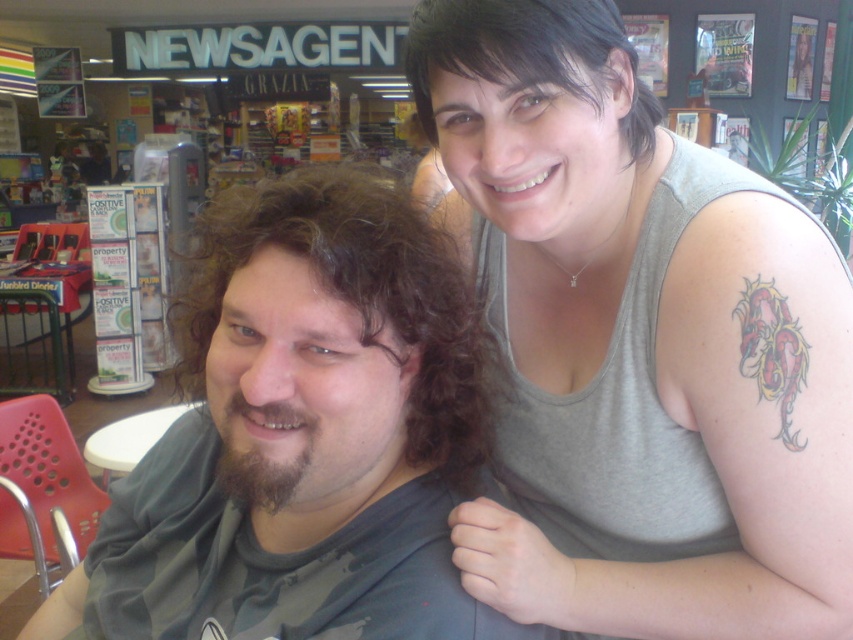
You are designing a photo frame for this image. The frame has a width limit of 10 inches. You need to ensure that both the gray tank top at upper right and the dark curly hair at left fit within the frame. Based on their widths, will the frame accommodate both objects without cropping?

The gray tank top at upper right has a larger width than the dark curly hair at left. Since the frame has a 10 inch width limit, it depends on the actual measurements of both objects. If the combined width of both objects exceeds 10 inches, the frame will not accommodate them without cropping. However, the provided information only states their relative sizes, not absolute dimensions, so exact fit cannot be determined without additional data.

You are standing in the newsagent store and want to ask the person in the gray matte shirt at center a question. Which direction should you walk to approach them from the gray tank top at upper right?

You should walk to the left to approach the gray matte shirt at center from the gray tank top at upper right, since the gray tank top at upper right is located to the right of the gray matte shirt at center.